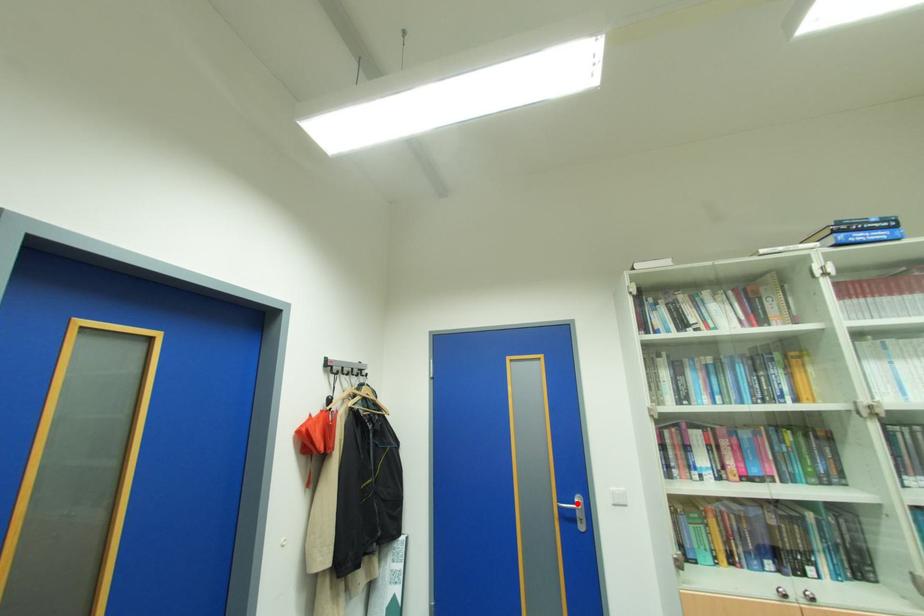
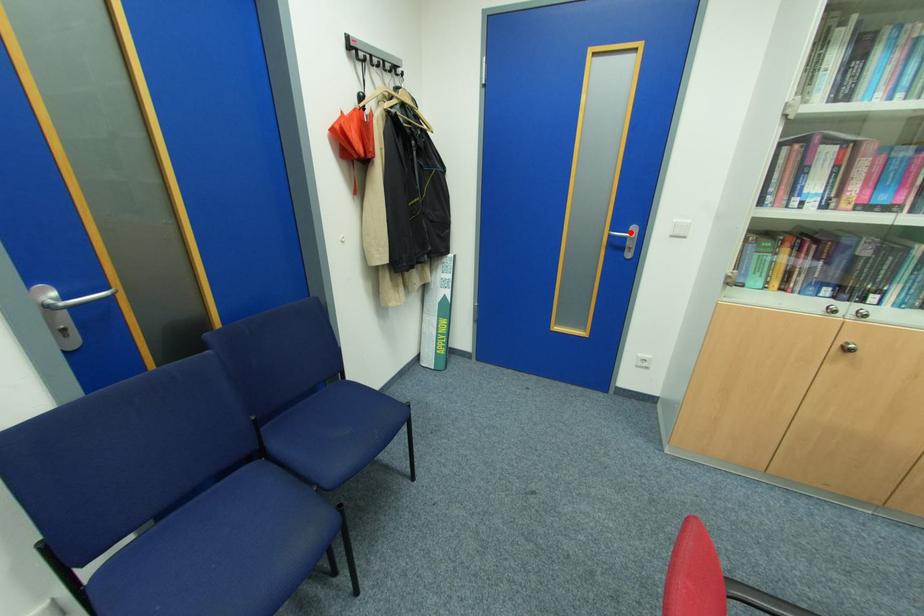
I am providing you with two images of the same scene from different viewpoints. A red point is marked on the first image and another point is marked on the second image. Does the point marked in image1 correspond to the same location as the one in image2?

Yes